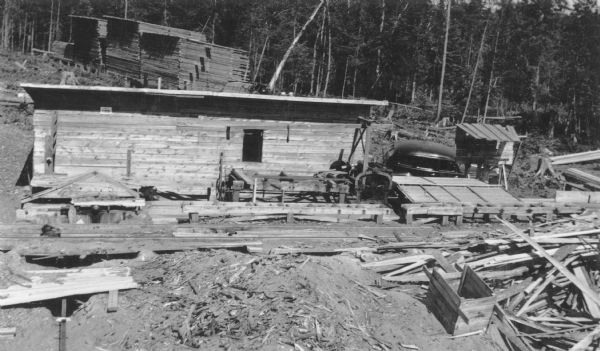
At what (x,y) coordinates should I click in order to perform the action: click on window. Please return your answer as a coordinate pair (x, y). The width and height of the screenshot is (600, 351). Looking at the image, I should click on (254, 151).